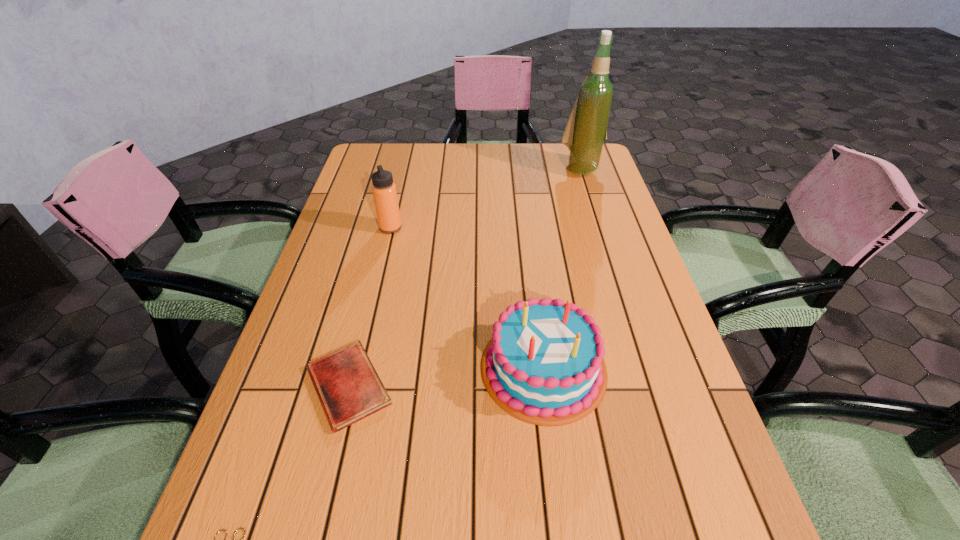
Identify the location of vacant space located on the right of the fourth tallest object. (577, 386).

At what (x,y) coordinates should I click in order to perform the action: click on object that is positioned at the far edge. Please return your answer as a coordinate pair (x, y). This screenshot has height=540, width=960. Looking at the image, I should click on (586, 130).

Identify the location of thermos bottle situated at the left edge. (384, 191).

This screenshot has width=960, height=540. Find the location of `diary present at the left edge`. diary present at the left edge is located at coordinates (349, 389).

Locate an element on the screen. wine bottle at the right edge is located at coordinates (586, 130).

This screenshot has height=540, width=960. Identify the location of birthday cake that is at the right edge. (544, 365).

You are a GUI agent. You are given a task and a screenshot of the screen. Output one action in this format:
    pyautogui.click(x=<x>, y=<y>)
    Task: Click on the object at the far right corner
    
    Given the screenshot: What is the action you would take?
    pyautogui.click(x=586, y=130)

At what (x,y) coordinates should I click in order to perform the action: click on vacant space at the far edge of the desktop. Please return your answer as a coordinate pair (x, y). The image size is (960, 540). Looking at the image, I should click on (455, 143).

Where is `free spot at the left edge of the desktop`? The width and height of the screenshot is (960, 540). free spot at the left edge of the desktop is located at coordinates (283, 533).

The width and height of the screenshot is (960, 540). In order to click on vacant area at the right edge of the desktop in this screenshot , I will do `click(649, 312)`.